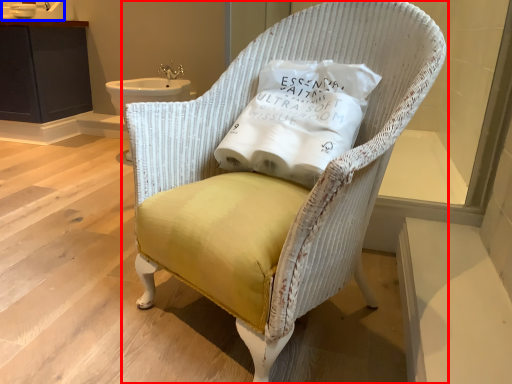
Question: Which point is closer to the camera, chair (highlighted by a red box) or sink (highlighted by a blue box)?

Choices:
 (A) chair
 (B) sink

Answer: (A)